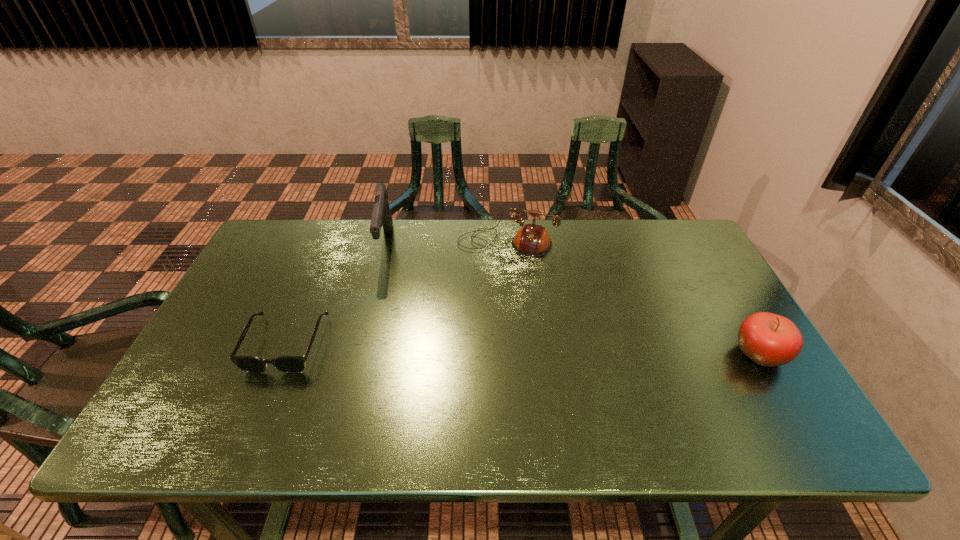
The width and height of the screenshot is (960, 540). I want to click on free space on the desktop that is between the sunglasses and the rightmost object and is positioned on the rotary dial of the third object from left to right, so click(466, 348).

The image size is (960, 540). I want to click on vacant space on the desktop that is between the sunglasses and the rightmost object and is positioned at the muzzle of the tallest object, so click(506, 348).